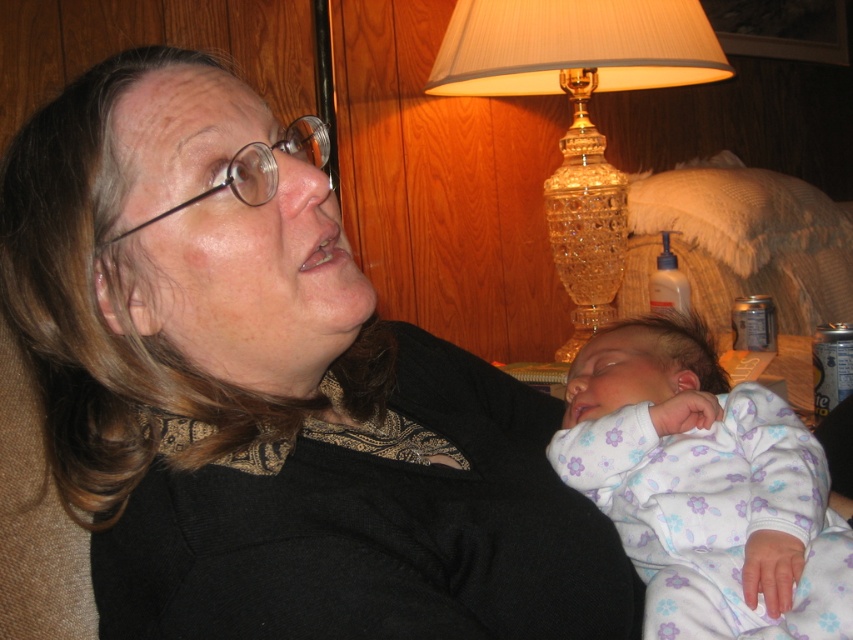
Who is positioned more to the right, floral cotton onesie at lower right or crystal glass lamp at upper right?

crystal glass lamp at upper right

Is point (583, 381) positioned before point (579, 68)?

Yes, point (583, 381) is closer to viewer.

Who is more distant from viewer, (602, 397) or (614, 241)?

Point (614, 241)

Where is `floral cotton onesie at lower right`? The width and height of the screenshot is (853, 640). floral cotton onesie at lower right is located at coordinates (704, 488).

Who is shorter, matte black sweater at center or floral cotton onesie at lower right?

floral cotton onesie at lower right is shorter.

Locate an element on the screen. The width and height of the screenshot is (853, 640). matte black sweater at center is located at coordinates (268, 394).

Does point (221, 403) lie behind point (657, 609)?

No, it is not.

Find the location of a particular element. Image resolution: width=853 pixels, height=640 pixels. matte black sweater at center is located at coordinates (268, 394).

Who is lower down, matte black sweater at center or crystal glass lamp at upper right?

matte black sweater at center

The width and height of the screenshot is (853, 640). What are the coordinates of `matte black sweater at center` in the screenshot? It's located at (268, 394).